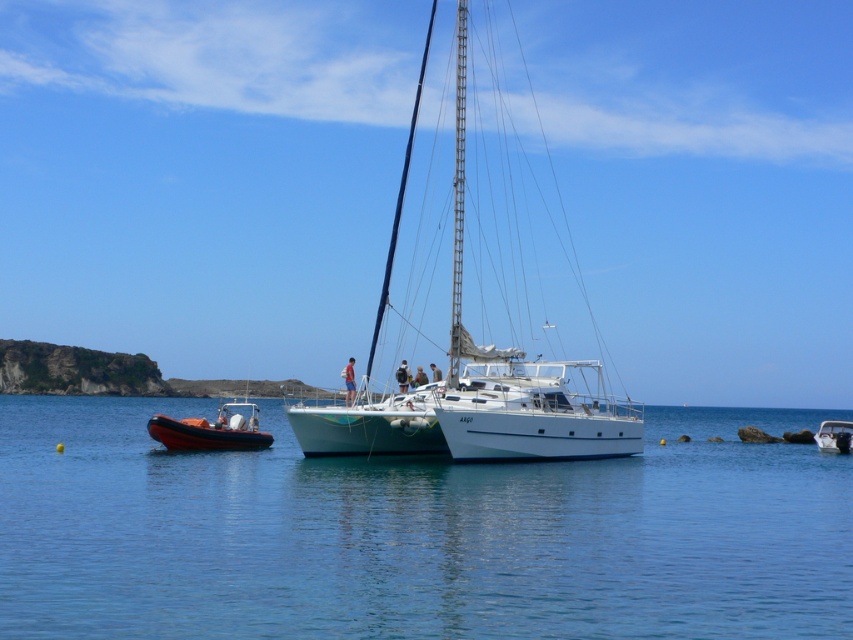
Is clear blue water at center bigger than orange rubber dinghy at left?

Yes, clear blue water at center is bigger than orange rubber dinghy at left.

Which of these two, clear blue water at center or orange rubber dinghy at left, stands taller?

Standing taller between the two is clear blue water at center.

Identify the location of clear blue water at center. The image size is (853, 640). (415, 532).

Is the position of clear blue water at center less distant than that of white glossy sailboat at center?

Yes.

Can you confirm if clear blue water at center is thinner than white glossy sailboat at center?

No, clear blue water at center is not thinner than white glossy sailboat at center.

This screenshot has height=640, width=853. What are the coordinates of `clear blue water at center` in the screenshot? It's located at (415, 532).

This screenshot has width=853, height=640. Identify the location of clear blue water at center. (415, 532).

Can you confirm if white glossy sailboat at center is thinner than orange rubber dinghy at left?

No.

Who is taller, white glossy sailboat at center or orange rubber dinghy at left?

white glossy sailboat at center

This screenshot has height=640, width=853. In order to click on white glossy sailboat at center in this screenshot , I will do `click(477, 385)`.